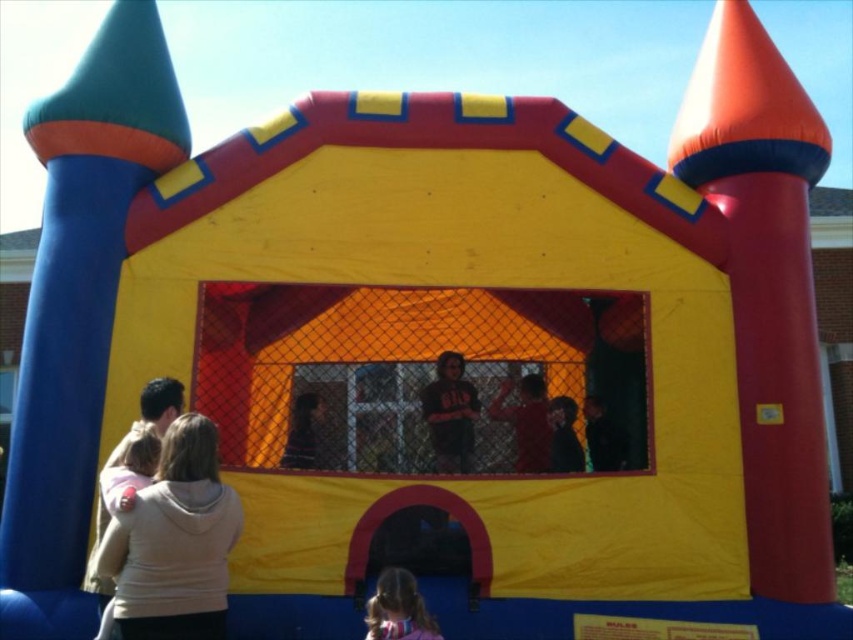
Question: Which point is closer to the camera?

Choices:
 (A) (204, 433)
 (B) (393, 612)

Answer: (A)

Question: Can you confirm if beige fleece jacket at lower left is positioned to the left of smooth pink hair at lower center?

Choices:
 (A) no
 (B) yes

Answer: (B)

Question: Which of the following is the closest to the observer?

Choices:
 (A) (366, 628)
 (B) (198, 637)

Answer: (B)

Question: Considering the relative positions of beige fleece jacket at lower left and smooth pink hair at lower center in the image provided, where is beige fleece jacket at lower left located with respect to smooth pink hair at lower center?

Choices:
 (A) below
 (B) above

Answer: (B)

Question: Is beige fleece jacket at lower left positioned at the back of smooth pink hair at lower center?

Choices:
 (A) yes
 (B) no

Answer: (B)